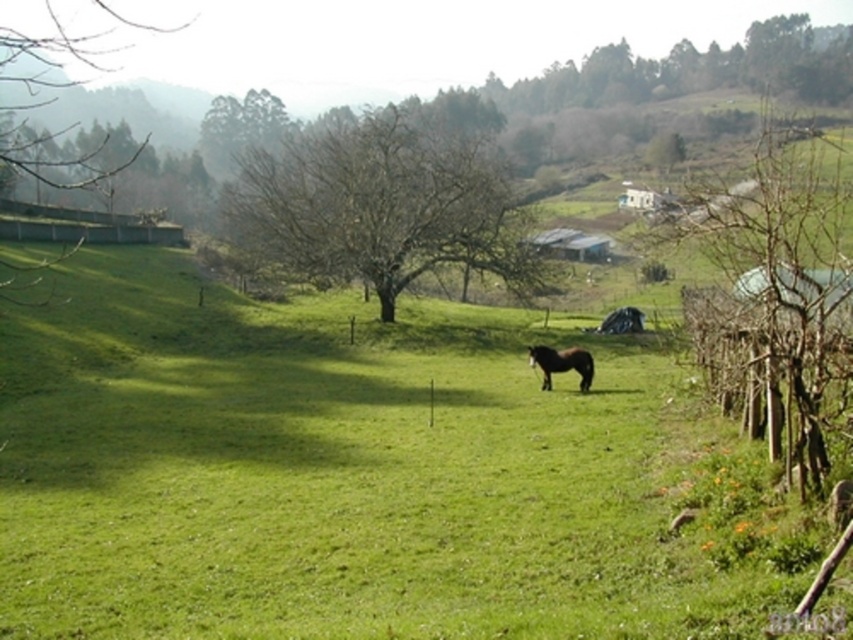
You are a photographer standing in the field and want to take a photo of the brown glossy horse at center without the bare wood tree at center blocking the view. Which direction should you move to ensure the tree is out of frame?

The bare wood tree at center is positioned over the brown glossy horse at center. To avoid the tree blocking the view, you should move to the left or right side of the field so that the tree is no longer directly above the horse in the frame.

You are a photographer standing in the field. You want to take a photo of the brown glossy horse at center and the bare wood tree at right. Based on their positions, will the tree appear in the background or foreground of the horse in the photo?

The bare wood tree at right is above the brown glossy horse at center, so in the photo, the tree will appear in the background of the horse.